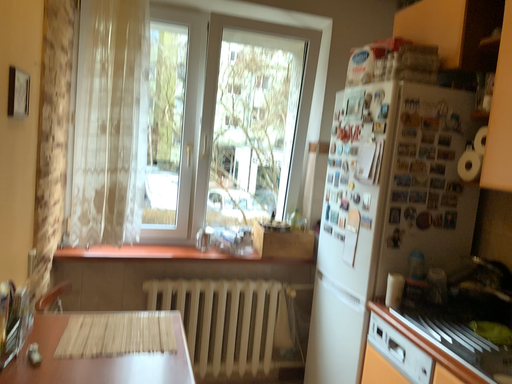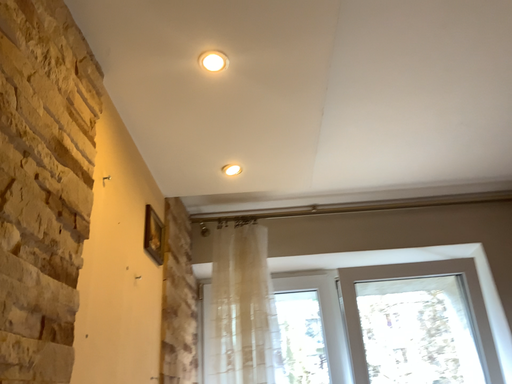
Question: How did the camera likely rotate when shooting the video?

Choices:
 (A) rotated upward
 (B) rotated downward

Answer: (A)